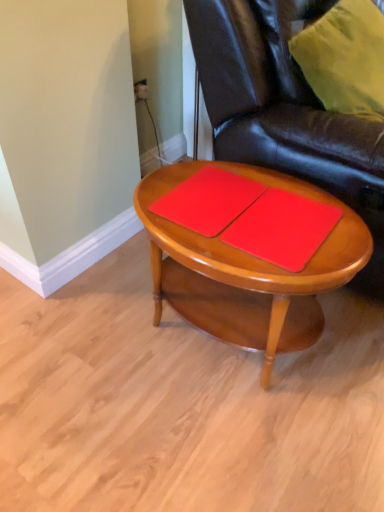
Where is `vacant space situated above matte wood coffee table at center (from a real-world perspective)`? vacant space situated above matte wood coffee table at center (from a real-world perspective) is located at coordinates (244, 211).